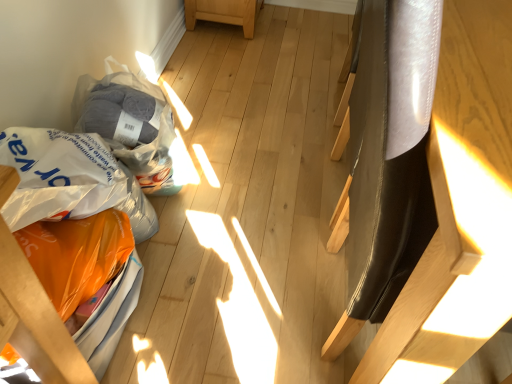
Locate an element on the screen. translucent plastic grocery bag at lower left, which ranks as the 2th grocery bag in bottom-to-top order is located at coordinates (129, 124).

The width and height of the screenshot is (512, 384). I want to click on orange plastic bag at lower left, marked as the 1th furniture in a left-to-right arrangement, so click(35, 320).

The height and width of the screenshot is (384, 512). Describe the element at coordinates (392, 226) in the screenshot. I see `shiny black chair at right, which appears as the first furniture when viewed from the right` at that location.

The width and height of the screenshot is (512, 384). I want to click on orange plastic grocery bag at lower left, the second grocery bag when ordered from top to bottom, so click(70, 180).

What do you see at coordinates (70, 180) in the screenshot? The height and width of the screenshot is (384, 512). I see `orange plastic grocery bag at lower left, the second grocery bag when ordered from top to bottom` at bounding box center [70, 180].

This screenshot has height=384, width=512. I want to click on translucent plastic grocery bag at lower left, the first grocery bag viewed from the top, so coord(129,124).

From a real-world perspective, is orange plastic bag at lower left, marked as the 1th furniture in a left-to-right arrangement, above or below shiny black chair at right, the second furniture positioned from the left?

From a real-world perspective, orange plastic bag at lower left, marked as the 1th furniture in a left-to-right arrangement, is physically below shiny black chair at right, the second furniture positioned from the left.

Is orange plastic bag at lower left, which ranks as the second furniture in right-to-left order, far away from shiny black chair at right, the second furniture positioned from the left?

orange plastic bag at lower left, which ranks as the second furniture in right-to-left order, is near shiny black chair at right, the second furniture positioned from the left, not far away.

From the image's perspective, which is above, orange plastic bag at lower left, marked as the 1th furniture in a left-to-right arrangement, or shiny black chair at right, which appears as the first furniture when viewed from the right?

shiny black chair at right, which appears as the first furniture when viewed from the right.

Which is more to the left, orange plastic bag at lower left, marked as the 1th furniture in a left-to-right arrangement, or shiny black chair at right, which appears as the first furniture when viewed from the right?

orange plastic bag at lower left, marked as the 1th furniture in a left-to-right arrangement.

Which is correct: orange plastic bag at lower left, which ranks as the second furniture in right-to-left order, is inside orange plastic grocery bag at lower left, which ranks as the 1th grocery bag in bottom-to-top order, or outside of it?

orange plastic bag at lower left, which ranks as the second furniture in right-to-left order, exists outside the volume of orange plastic grocery bag at lower left, which ranks as the 1th grocery bag in bottom-to-top order.

Can you confirm if orange plastic bag at lower left, which ranks as the second furniture in right-to-left order, is smaller than orange plastic grocery bag at lower left, which ranks as the 1th grocery bag in bottom-to-top order?

Actually, orange plastic bag at lower left, which ranks as the second furniture in right-to-left order, might be larger than orange plastic grocery bag at lower left, which ranks as the 1th grocery bag in bottom-to-top order.

Can you tell me how much orange plastic bag at lower left, which ranks as the second furniture in right-to-left order, and orange plastic grocery bag at lower left, which ranks as the 1th grocery bag in bottom-to-top order, differ in facing direction?

There is a 0.00021-degree angle between the facing directions of orange plastic bag at lower left, which ranks as the second furniture in right-to-left order, and orange plastic grocery bag at lower left, which ranks as the 1th grocery bag in bottom-to-top order.

From the image's perspective, which is above, translucent plastic grocery bag at lower left, the first grocery bag viewed from the top, or shiny black chair at right, the second furniture positioned from the left?

shiny black chair at right, the second furniture positioned from the left, from the image's perspective.

In the scene shown: Would you say translucent plastic grocery bag at lower left, which ranks as the 2th grocery bag in bottom-to-top order, is to the left or to the right of shiny black chair at right, the second furniture positioned from the left, in the picture?

→ Clearly, translucent plastic grocery bag at lower left, which ranks as the 2th grocery bag in bottom-to-top order, is on the left of shiny black chair at right, the second furniture positioned from the left, in the image.

Does translucent plastic grocery bag at lower left, the first grocery bag viewed from the top, lie behind shiny black chair at right, the second furniture positioned from the left?

Yes, translucent plastic grocery bag at lower left, the first grocery bag viewed from the top, is further from the camera.

Could you tell me if translucent plastic grocery bag at lower left, which ranks as the 2th grocery bag in bottom-to-top order, is facing shiny black chair at right, the second furniture positioned from the left?

Yes, translucent plastic grocery bag at lower left, which ranks as the 2th grocery bag in bottom-to-top order, is turned towards shiny black chair at right, the second furniture positioned from the left.

From the image's perspective, which is below, orange plastic grocery bag at lower left, which ranks as the 1th grocery bag in bottom-to-top order, or shiny black chair at right, which appears as the first furniture when viewed from the right?

orange plastic grocery bag at lower left, which ranks as the 1th grocery bag in bottom-to-top order.

Would you say orange plastic grocery bag at lower left, the second grocery bag when ordered from top to bottom, is outside shiny black chair at right, the second furniture positioned from the left?

Yes.

From a real-world perspective, is orange plastic grocery bag at lower left, the second grocery bag when ordered from top to bottom, below shiny black chair at right, which appears as the first furniture when viewed from the right?

Yes.

Between orange plastic grocery bag at lower left, which ranks as the 1th grocery bag in bottom-to-top order, and shiny black chair at right, which appears as the first furniture when viewed from the right, which one has smaller width?

Thinner between the two is orange plastic grocery bag at lower left, which ranks as the 1th grocery bag in bottom-to-top order.

From a real-world perspective, starting from the orange plastic bag at lower left, which ranks as the second furniture in right-to-left order, which grocery bag is the 2nd one below it? Please provide its 2D coordinates.

[(70, 180)]

From a real-world perspective, is orange plastic grocery bag at lower left, which ranks as the 1th grocery bag in bottom-to-top order, positioned under orange plastic bag at lower left, which ranks as the second furniture in right-to-left order, based on gravity?

Yes.

Which of these two, orange plastic grocery bag at lower left, which ranks as the 1th grocery bag in bottom-to-top order, or orange plastic bag at lower left, marked as the 1th furniture in a left-to-right arrangement, is wider?

orange plastic bag at lower left, marked as the 1th furniture in a left-to-right arrangement, is wider.

From the image's perspective, between orange plastic grocery bag at lower left, the second grocery bag when ordered from top to bottom, and orange plastic bag at lower left, which ranks as the second furniture in right-to-left order, who is located below?

orange plastic bag at lower left, which ranks as the second furniture in right-to-left order, is shown below in the image.

From the picture: Does shiny black chair at right, the second furniture positioned from the left, have a greater height compared to translucent plastic grocery bag at lower left, the first grocery bag viewed from the top?

Yes.

From a real-world perspective, is shiny black chair at right, which appears as the first furniture when viewed from the right, positioned under translucent plastic grocery bag at lower left, the first grocery bag viewed from the top, based on gravity?

Actually, shiny black chair at right, which appears as the first furniture when viewed from the right, is physically above translucent plastic grocery bag at lower left, the first grocery bag viewed from the top, in the real world.

In terms of size, does shiny black chair at right, which appears as the first furniture when viewed from the right, appear bigger or smaller than translucent plastic grocery bag at lower left, the first grocery bag viewed from the top?

Clearly, shiny black chair at right, which appears as the first furniture when viewed from the right, is larger in size than translucent plastic grocery bag at lower left, the first grocery bag viewed from the top.

Starting from the shiny black chair at right, which appears as the first furniture when viewed from the right, which grocery bag is the 2nd one behind? Please provide its 2D coordinates.

[(129, 124)]

Identify the location of furniture that is the 2nd object located in front of the orange plastic grocery bag at lower left, which ranks as the 1th grocery bag in bottom-to-top order. This screenshot has width=512, height=384. (392, 226).

Consider the image. Is the position of shiny black chair at right, the second furniture positioned from the left, more distant than that of orange plastic grocery bag at lower left, the second grocery bag when ordered from top to bottom?

No, it is not.

Can you confirm if shiny black chair at right, which appears as the first furniture when viewed from the right, is taller than orange plastic grocery bag at lower left, the second grocery bag when ordered from top to bottom?

Correct, shiny black chair at right, which appears as the first furniture when viewed from the right, is much taller as orange plastic grocery bag at lower left, the second grocery bag when ordered from top to bottom.

In the scene shown: Is shiny black chair at right, which appears as the first furniture when viewed from the right, positioned with its back to orange plastic grocery bag at lower left, the second grocery bag when ordered from top to bottom?

Yes, shiny black chair at right, which appears as the first furniture when viewed from the right, is facing away from orange plastic grocery bag at lower left, the second grocery bag when ordered from top to bottom.

In order to click on furniture on the right of orange plastic bag at lower left, which ranks as the second furniture in right-to-left order in this screenshot , I will do `click(392, 226)`.

The height and width of the screenshot is (384, 512). I want to click on grocery bag that is the 2nd object directly below the orange plastic bag at lower left, which ranks as the second furniture in right-to-left order (from a real-world perspective), so click(70, 180).

Estimate the real-world distances between objects in this image. Which object is closer to shiny black chair at right, the second furniture positioned from the left, orange plastic grocery bag at lower left, the second grocery bag when ordered from top to bottom, or translucent plastic grocery bag at lower left, which ranks as the 2th grocery bag in bottom-to-top order?

Based on the image, orange plastic grocery bag at lower left, the second grocery bag when ordered from top to bottom, appears to be nearer to shiny black chair at right, the second furniture positioned from the left.

From the image, which object appears to be nearer to orange plastic grocery bag at lower left, which ranks as the 1th grocery bag in bottom-to-top order, translucent plastic grocery bag at lower left, which ranks as the 2th grocery bag in bottom-to-top order, or orange plastic bag at lower left, which ranks as the second furniture in right-to-left order?

The object closer to orange plastic grocery bag at lower left, which ranks as the 1th grocery bag in bottom-to-top order, is orange plastic bag at lower left, which ranks as the second furniture in right-to-left order.

Looking at the image, which one is located further to orange plastic bag at lower left, which ranks as the second furniture in right-to-left order, translucent plastic grocery bag at lower left, which ranks as the 2th grocery bag in bottom-to-top order, or orange plastic grocery bag at lower left, which ranks as the 1th grocery bag in bottom-to-top order?

Among the two, translucent plastic grocery bag at lower left, which ranks as the 2th grocery bag in bottom-to-top order, is located further to orange plastic bag at lower left, which ranks as the second furniture in right-to-left order.

From the image, which object appears to be farther from shiny black chair at right, the second furniture positioned from the left, orange plastic bag at lower left, which ranks as the second furniture in right-to-left order, or orange plastic grocery bag at lower left, which ranks as the 1th grocery bag in bottom-to-top order?

orange plastic grocery bag at lower left, which ranks as the 1th grocery bag in bottom-to-top order.

When comparing their distances from orange plastic bag at lower left, which ranks as the second furniture in right-to-left order, does shiny black chair at right, which appears as the first furniture when viewed from the right, or translucent plastic grocery bag at lower left, the first grocery bag viewed from the top, seem closer?

translucent plastic grocery bag at lower left, the first grocery bag viewed from the top, lies closer to orange plastic bag at lower left, which ranks as the second furniture in right-to-left order, than the other object.

When comparing their distances from translucent plastic grocery bag at lower left, the first grocery bag viewed from the top, does orange plastic grocery bag at lower left, which ranks as the 1th grocery bag in bottom-to-top order, or shiny black chair at right, which appears as the first furniture when viewed from the right, seem further?

shiny black chair at right, which appears as the first furniture when viewed from the right, is further to translucent plastic grocery bag at lower left, the first grocery bag viewed from the top.

When comparing their distances from orange plastic bag at lower left, which ranks as the second furniture in right-to-left order, does orange plastic grocery bag at lower left, which ranks as the 1th grocery bag in bottom-to-top order, or translucent plastic grocery bag at lower left, the first grocery bag viewed from the top, seem further?

translucent plastic grocery bag at lower left, the first grocery bag viewed from the top, is positioned further to the anchor orange plastic bag at lower left, which ranks as the second furniture in right-to-left order.

Looking at the image, which one is located further to translucent plastic grocery bag at lower left, which ranks as the 2th grocery bag in bottom-to-top order, orange plastic grocery bag at lower left, the second grocery bag when ordered from top to bottom, or orange plastic bag at lower left, marked as the 1th furniture in a left-to-right arrangement?

The object further to translucent plastic grocery bag at lower left, which ranks as the 2th grocery bag in bottom-to-top order, is orange plastic bag at lower left, marked as the 1th furniture in a left-to-right arrangement.

Locate an element on the screen. This screenshot has height=384, width=512. grocery bag between orange plastic bag at lower left, marked as the 1th furniture in a left-to-right arrangement, and translucent plastic grocery bag at lower left, the first grocery bag viewed from the top, along the z-axis is located at coordinates (70, 180).

You are a GUI agent. You are given a task and a screenshot of the screen. Output one action in this format:
    pyautogui.click(x=<x>, y=<y>)
    Task: Click on the grocery bag between orange plastic grocery bag at lower left, which ranks as the 1th grocery bag in bottom-to-top order, and shiny black chair at right, which appears as the first furniture when viewed from the right, in the horizontal direction
    The width and height of the screenshot is (512, 384).
    Given the screenshot: What is the action you would take?
    pyautogui.click(x=129, y=124)